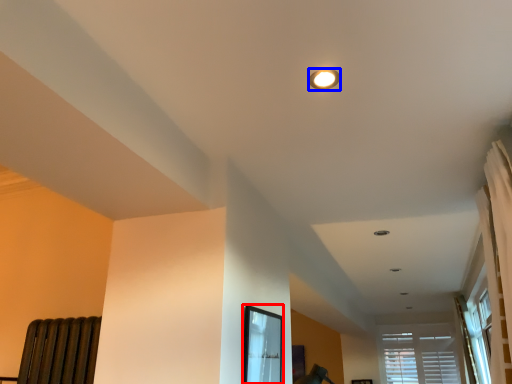
Question: Which point is closer to the camera, bay window (highlighted by a red box) or lighting (highlighted by a blue box)?

Choices:
 (A) bay window
 (B) lighting

Answer: (B)